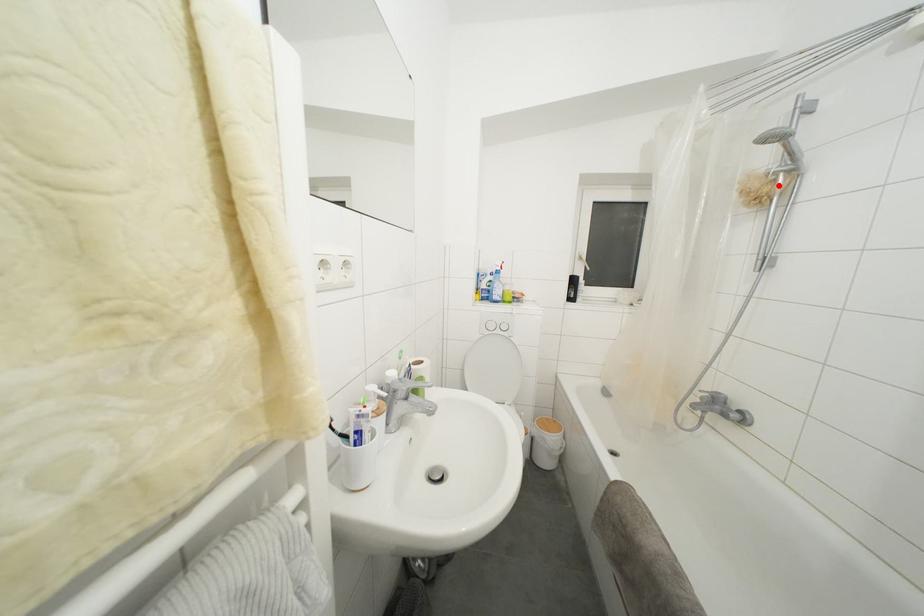
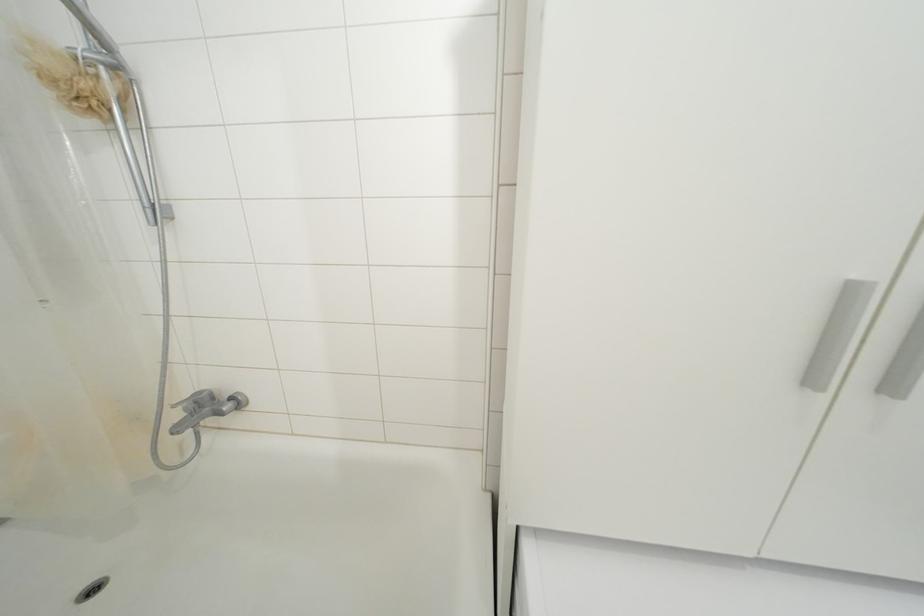
Locate, in the second image, the point that corresponds to the highlighted location in the first image.

(100, 79)